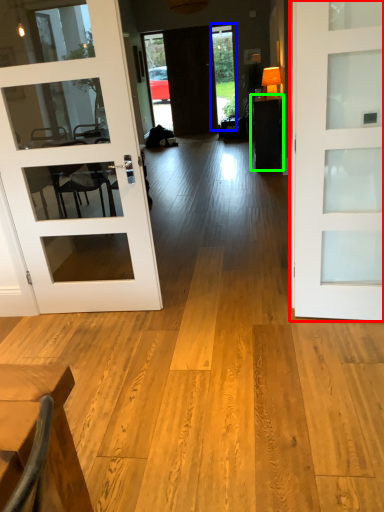
Question: Considering the real-world distances, which object is farthest from door (highlighted by a red box)? window (highlighted by a blue box) or table (highlighted by a green box)?

Choices:
 (A) window
 (B) table

Answer: (A)